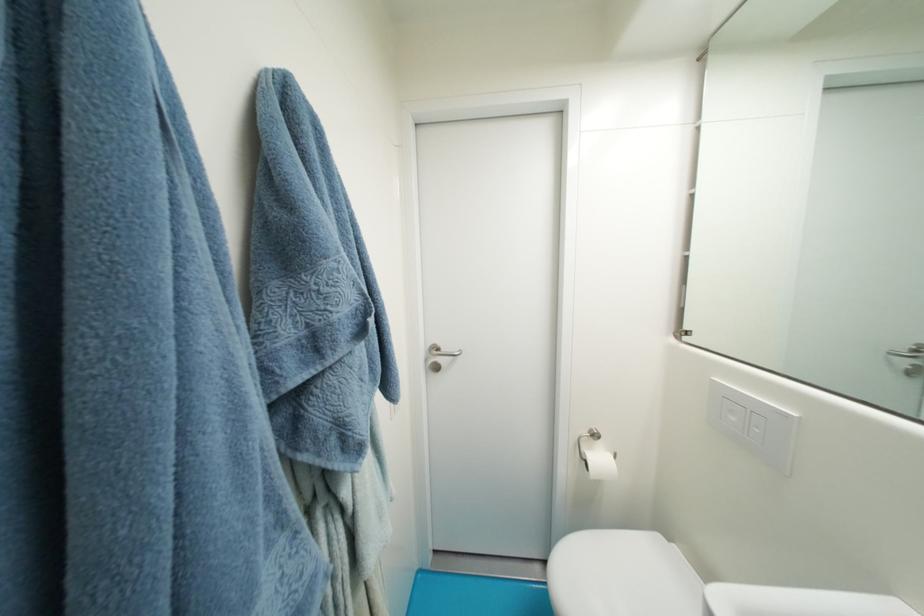
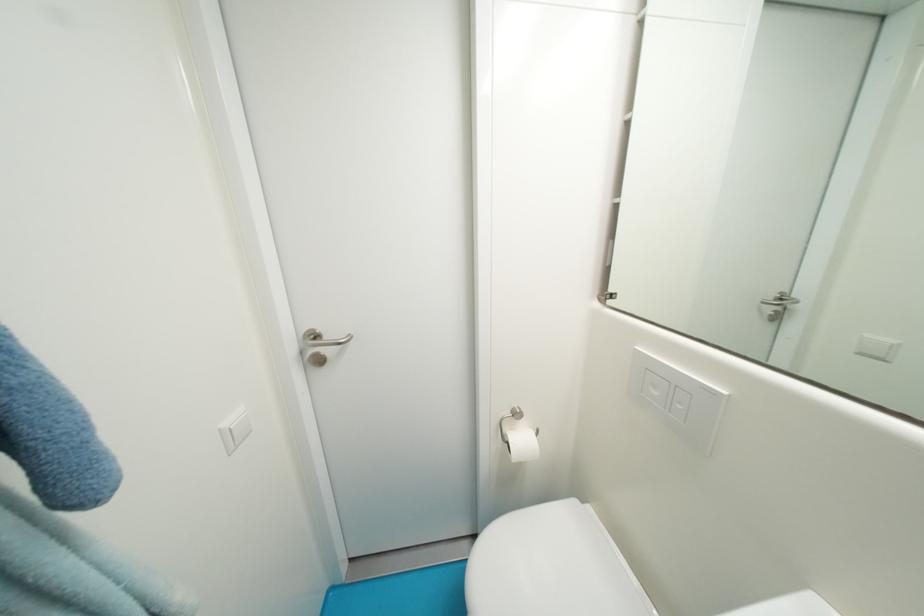
Where in the second image is the point corresponding to pixel 738 421 from the first image?

(662, 395)